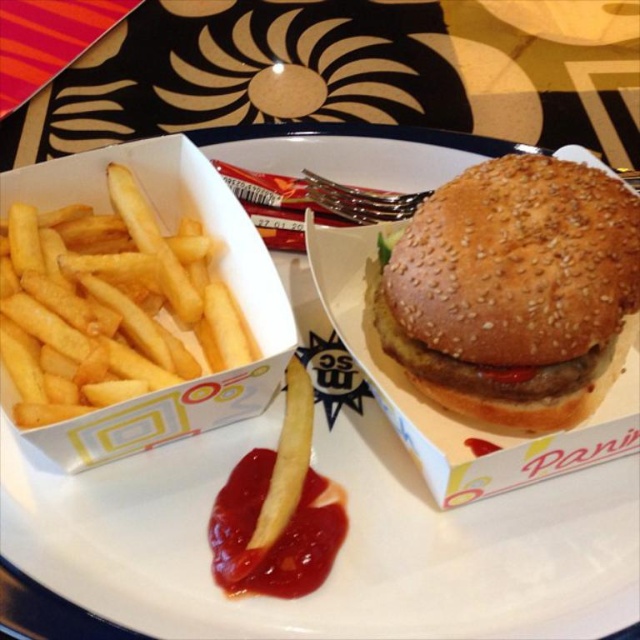
Question: Among these objects, which one is farthest from the camera?

Choices:
 (A) golden crispy french fries at left
 (B) sesame seed bun at center
 (C) red glossy ketchup at lower center

Answer: (C)

Question: Which of the following is the farthest from the observer?

Choices:
 (A) sesame seed bun at center
 (B) golden crispy french fries at left

Answer: (A)

Question: Does golden crispy french fries at left appear over red glossy ketchup at lower center?

Choices:
 (A) no
 (B) yes

Answer: (B)

Question: Is sesame seed bun at center thinner than red glossy ketchup at lower center?

Choices:
 (A) no
 (B) yes

Answer: (A)

Question: Among these objects, which one is nearest to the camera?

Choices:
 (A) red glossy ketchup at lower center
 (B) sesame seed bun at center
 (C) golden crispy french fries at left

Answer: (C)

Question: Is sesame seed bun at center positioned behind golden crispy french fries at left?

Choices:
 (A) yes
 (B) no

Answer: (A)